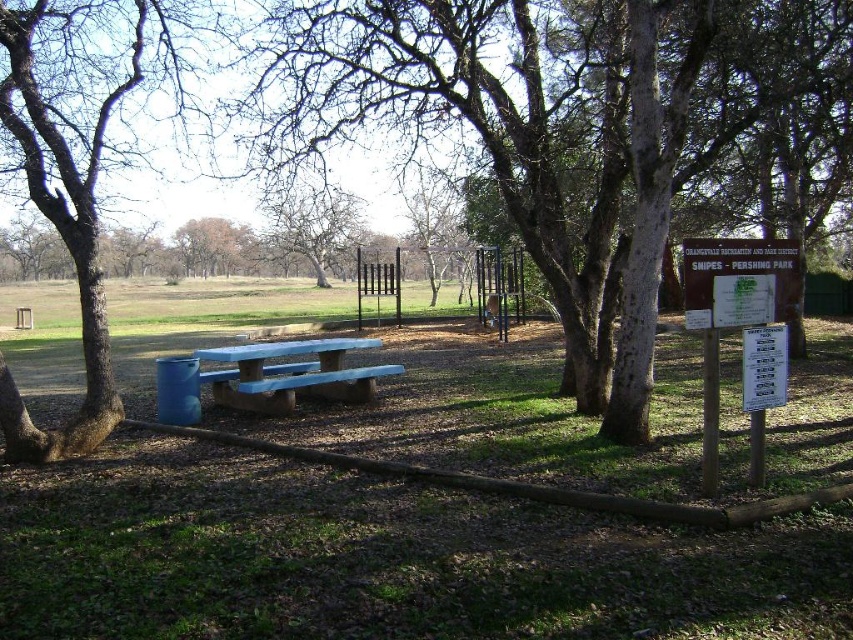
You are planning to set up a small art display on the blue concrete picnic table at center and the green paper sign at right. Which surface has a larger width for placing items?

The blue concrete picnic table at center has a larger width than the green paper sign at right, making it more suitable for placing items.

You are standing at the picnic table and want to take a photo of both the point at coordinates (96, 90) and the point at coordinates (445, 230). Which point should you focus on first to ensure both are in focus?

You should focus on the point at coordinates (96, 90) first because it is closer to the camera than the point at coordinates (445, 230). This way, both points will be in focus as the closer point sets the focal plane.